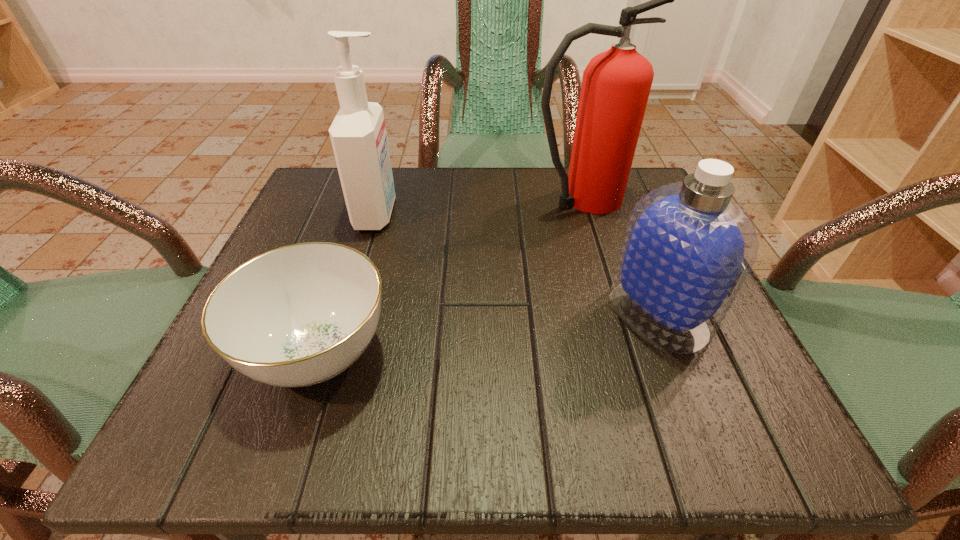
This screenshot has width=960, height=540. In the image, there is a desktop. In order to click on vacant space at the far edge in this screenshot , I will do `click(500, 231)`.

Where is `blank area at the near edge`? The image size is (960, 540). blank area at the near edge is located at coordinates (556, 403).

The image size is (960, 540). I want to click on blank space at the right edge of the desktop, so click(x=720, y=365).

Identify the location of free space at the far left corner. (302, 227).

At what (x,y) coordinates should I click in order to perform the action: click on free location at the near left corner. Please return your answer as a coordinate pair (x, y). The width and height of the screenshot is (960, 540). Looking at the image, I should click on (204, 421).

Locate an element on the screen. The width and height of the screenshot is (960, 540). vacant space at the far right corner is located at coordinates (601, 231).

In the image, there is a desktop. Identify the location of vacant space at the near right corner. The image size is (960, 540). tap(710, 429).

In order to click on free space between the nearer cleansing agent and the left cleansing agent in this screenshot , I will do `click(517, 264)`.

At what (x,y) coordinates should I click in order to perform the action: click on free space between the fire extinguisher and the left cleansing agent. Please return your answer as a coordinate pair (x, y). This screenshot has height=540, width=960. Looking at the image, I should click on (478, 206).

This screenshot has width=960, height=540. I want to click on vacant area between the right cleansing agent and the shortest object, so click(488, 334).